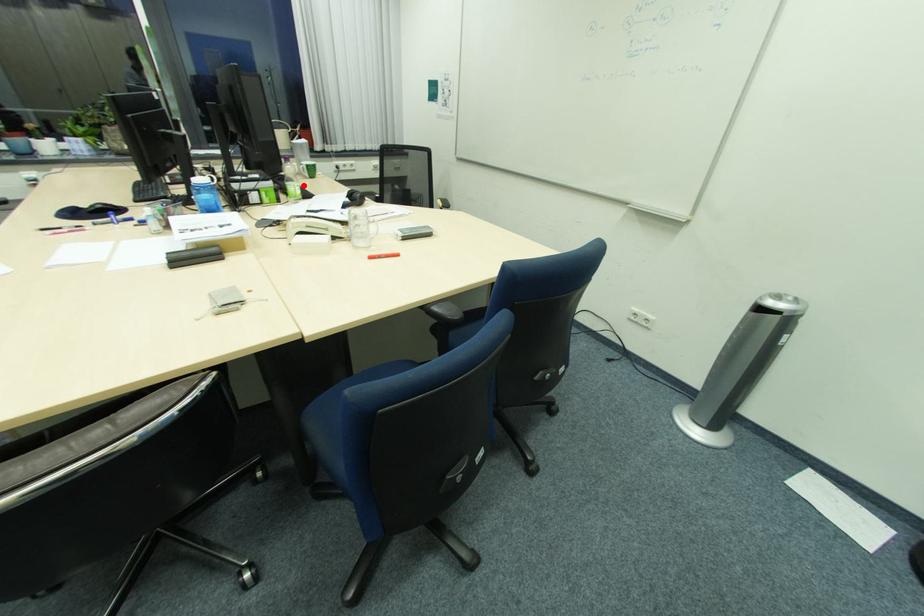
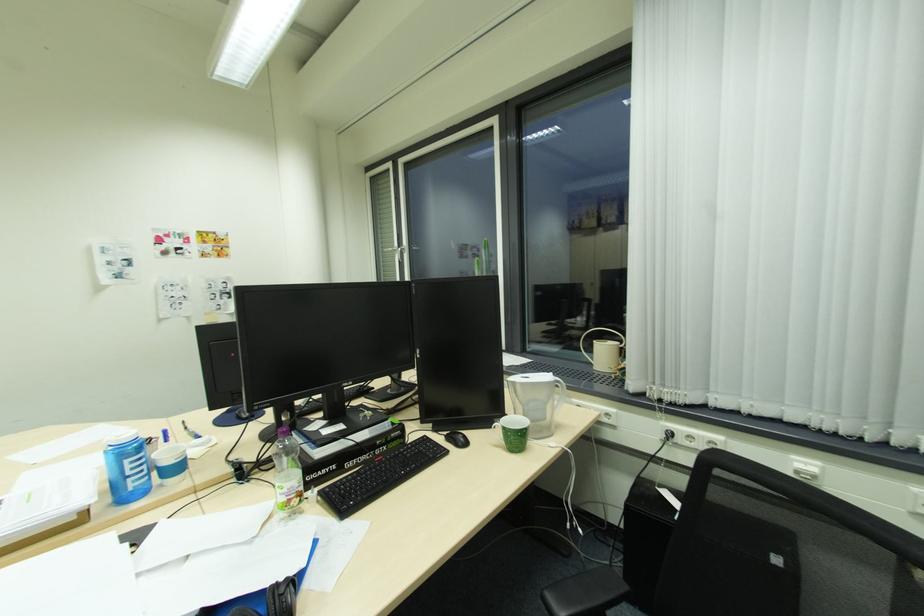
Where in the second image is the point corresponding to the highlighted location from the first image?

(286, 485)